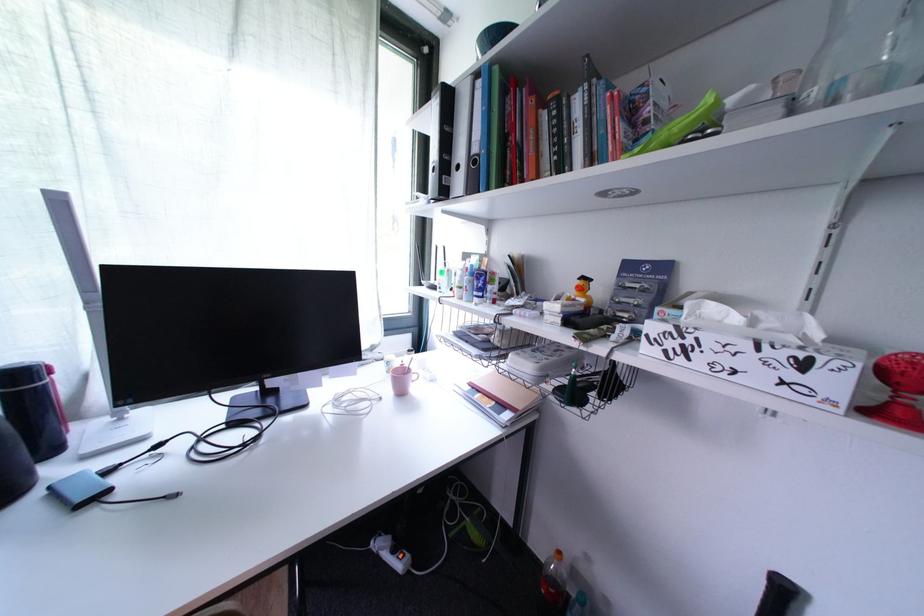
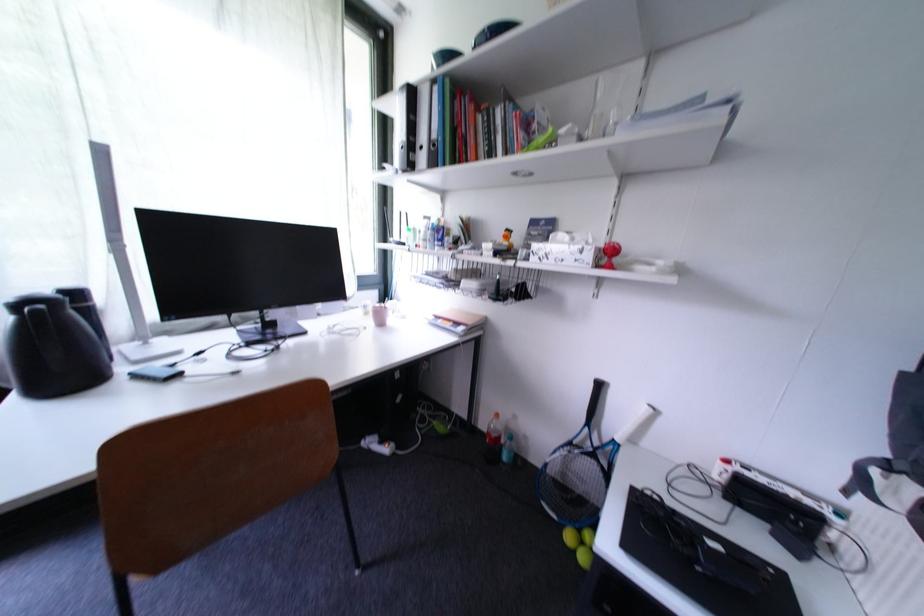
Locate, in the second image, the point that corresponds to the point at 487,86 in the first image.

(444, 91)